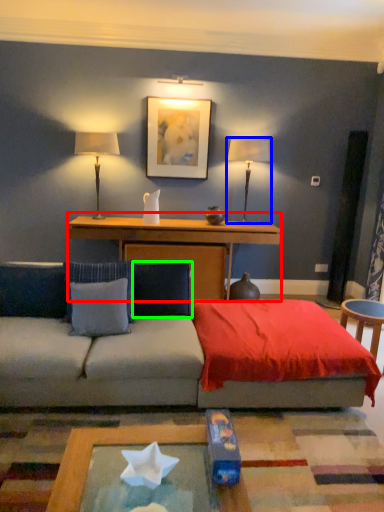
Question: Considering the real-world distances, which object is farthest from table (highlighted by a red box)? table lamp (highlighted by a blue box) or pillow (highlighted by a green box)?

Choices:
 (A) table lamp
 (B) pillow

Answer: (B)